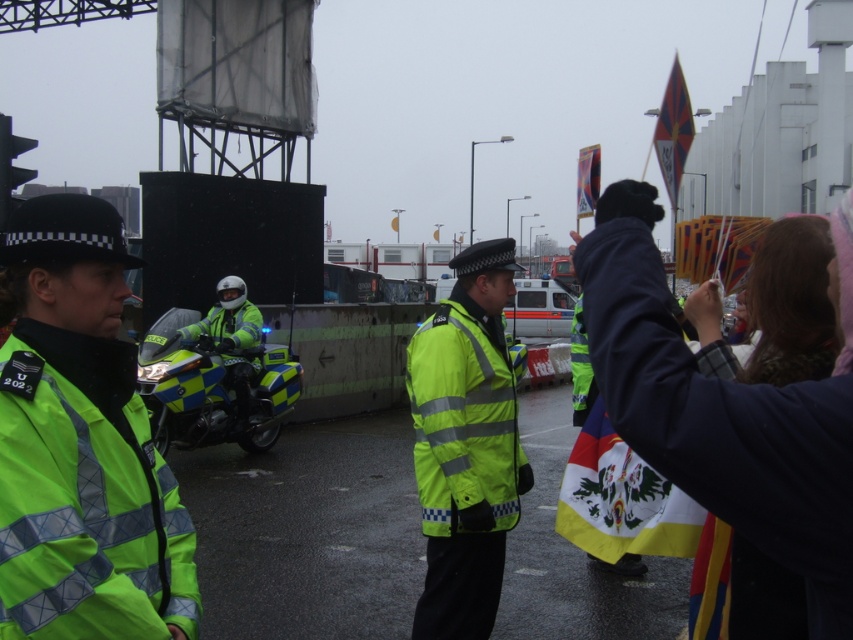
You are a pedestrian trying to identify the nearest officer to you. Based on the scene, which neon yellow reflective jacket is closer to your position? The neon yellow reflective jacket at left or the neon yellow reflective jacket at center?

The neon yellow reflective jacket at left is closer because it has a smaller size compared to the neon yellow reflective jacket at center, indicating it is nearer to the observer.

You are a protest organizer standing at the edge of the scene. You notice a dark blue fabric at upper right that you want to hang a banner on. Can you safely reach it from where you are standing?

The dark blue fabric at upper right is 1.36 meters away from the viewer, so if the protester can reach that distance, they might be able to hang the banner. However, safety depends on stable footing and no obstacles between them and the fabric.

You are a pedestrian trying to cross the street and notice the dark blue fabric at upper right and the neon yellow reflective jacket at center in the distance. Which object appears closer to you based on their sizes?

The neon yellow reflective jacket at center appears closer because it is taller than the dark blue fabric at upper right.